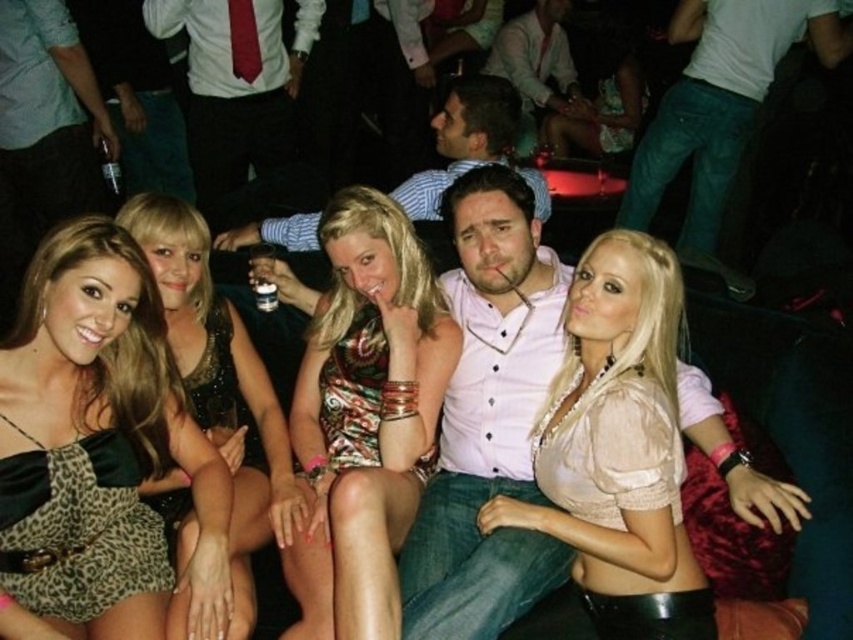
You are a photographer at the event and need to capture a group photo. The leopard print dress at center and the matte white shirt at center are both in the frame. Which of these two items has a wider appearance in the photo?

The matte white shirt at center has a wider appearance than the leopard print dress at center in the photo because the leopard print dress at center is narrower than the matte white shirt at center.